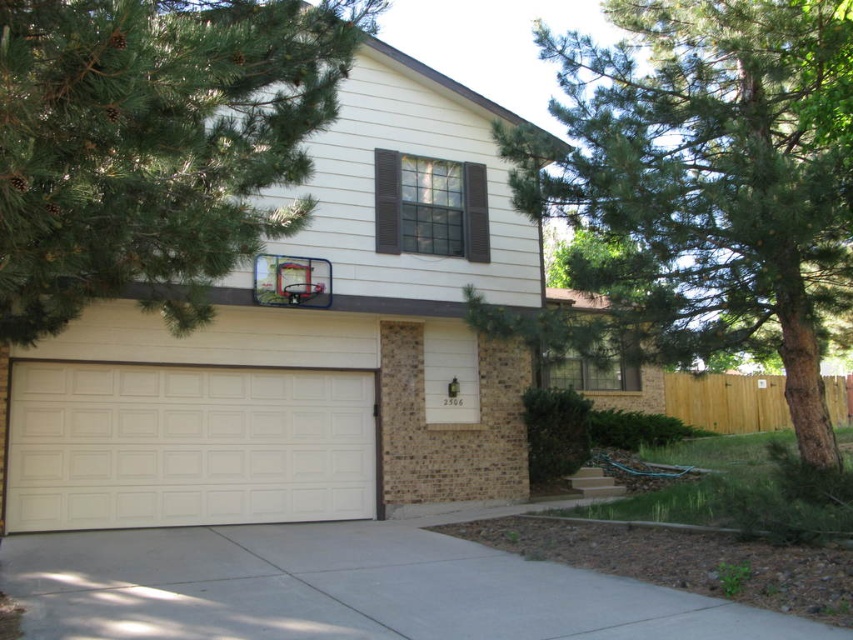
Question: Does green leafy tree at upper right appear on the left side of gray concrete driveway at lower center?

Choices:
 (A) yes
 (B) no

Answer: (B)

Question: Does green leafy tree at upper left have a greater width compared to metallic silver basketball hoop at upper center?

Choices:
 (A) no
 (B) yes

Answer: (B)

Question: Which point appears farthest from the camera in this image?

Choices:
 (A) (793, 205)
 (B) (125, 307)

Answer: (B)

Question: Based on their relative distances, which object is farther from the green leafy tree at upper left?

Choices:
 (A) gray concrete driveway at lower center
 (B) white textured garage door at center
 (C) green leafy tree at upper right
 (D) metallic silver basketball hoop at upper center

Answer: (C)

Question: Is white painted wood garage door at center wider than white textured garage door at center?

Choices:
 (A) no
 (B) yes

Answer: (A)

Question: Which point is closer to the camera?

Choices:
 (A) green leafy tree at upper left
 (B) green leafy tree at upper right

Answer: (A)